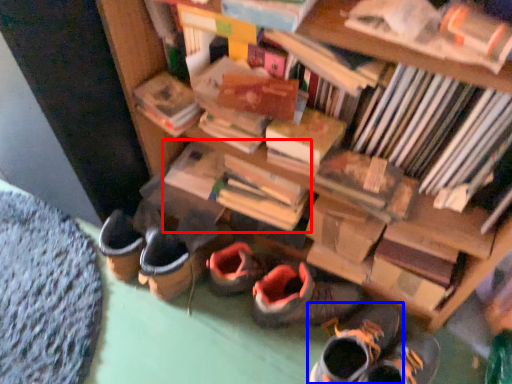
Question: Which of the following is the farthest to the observer, book (highlighted by a red box) or footwear (highlighted by a blue box)?

Choices:
 (A) book
 (B) footwear

Answer: (A)